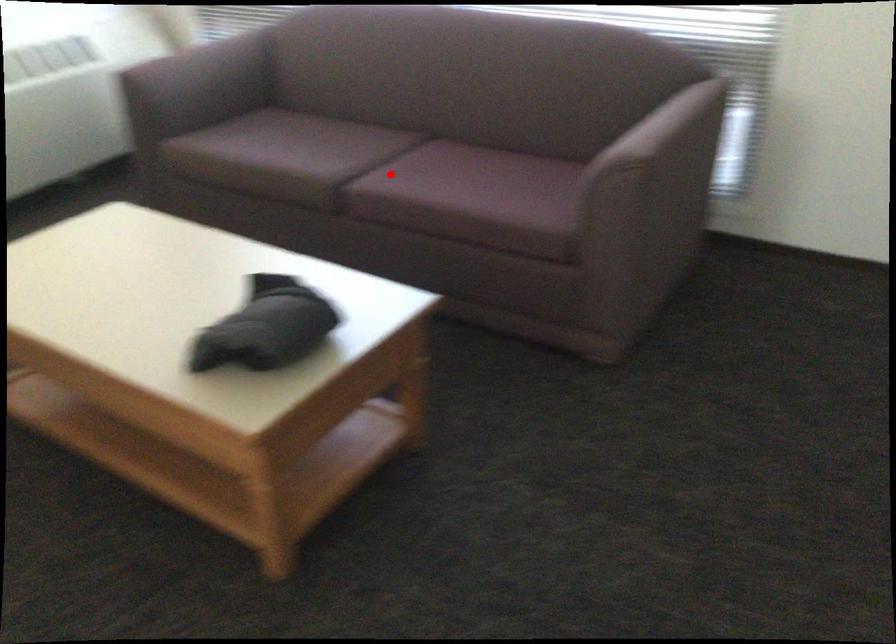
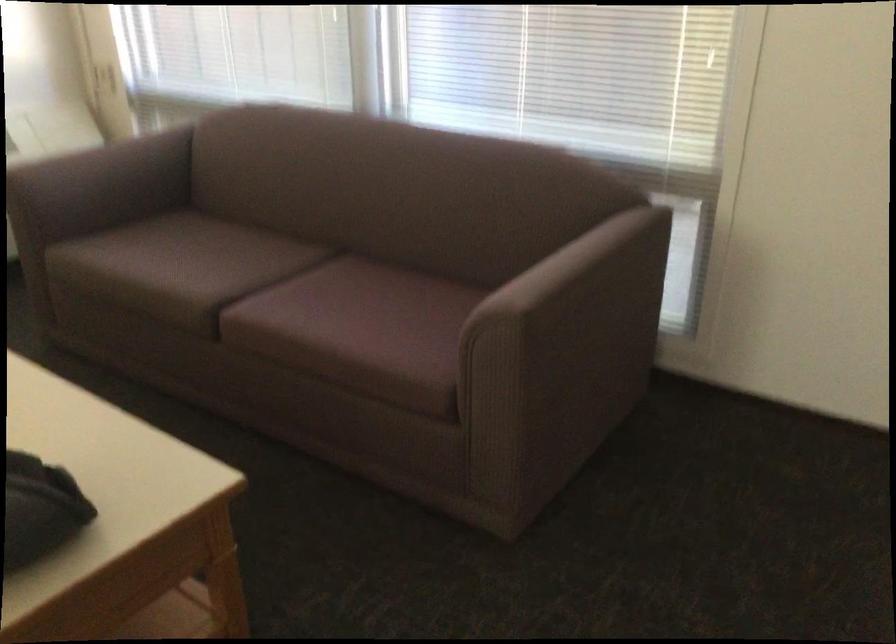
Question: I am providing you with two images of the same scene from different viewpoints. A red point is shown in image1. For the corresponding object point in image2, is it positioned nearer or farther from the camera?

Choices:
 (A) Nearer
 (B) Farther

Answer: (A)